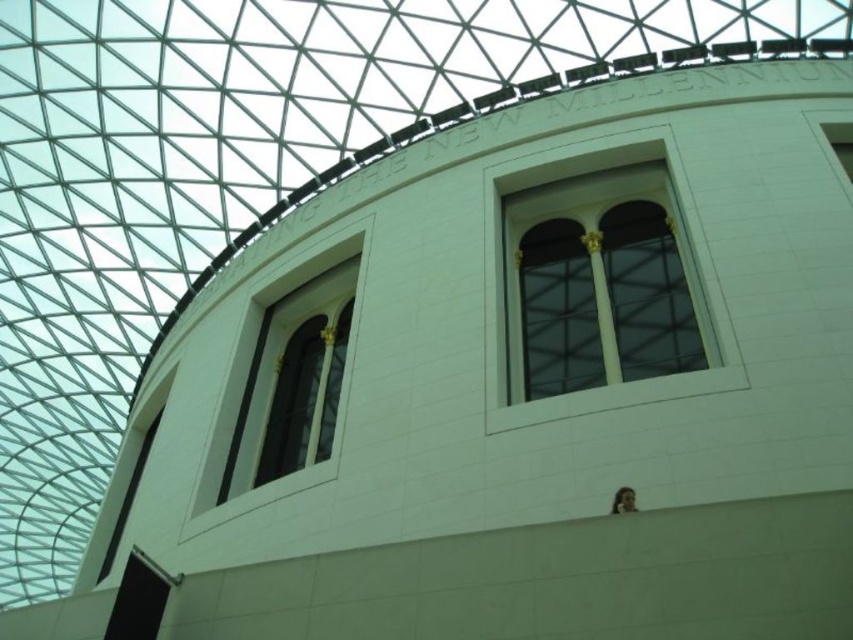
Does matte glass window at upper left appear under matte glass window at upper center?

Indeed, matte glass window at upper left is positioned under matte glass window at upper center.

Can you confirm if matte glass window at upper left is wider than matte glass window at upper center?

No, matte glass window at upper left is not wider than matte glass window at upper center.

Is point (259, 429) closer to viewer compared to point (485, 376)?

No, (259, 429) is behind (485, 376).

You are a GUI agent. You are given a task and a screenshot of the screen. Output one action in this format:
    pyautogui.click(x=<x>, y=<y>)
    Task: Click on the matte glass window at upper left
    This screenshot has width=853, height=640.
    Given the screenshot: What is the action you would take?
    pyautogui.click(x=292, y=381)